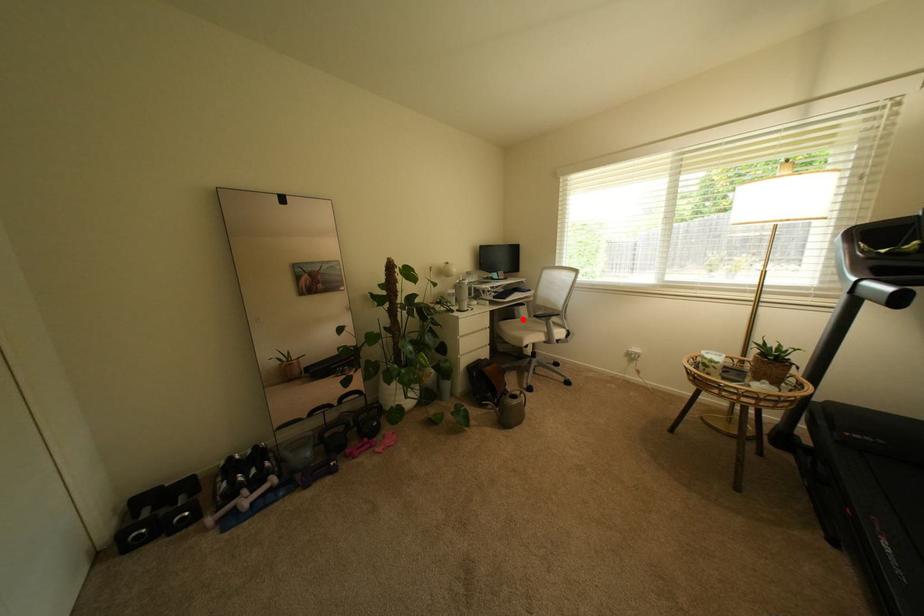
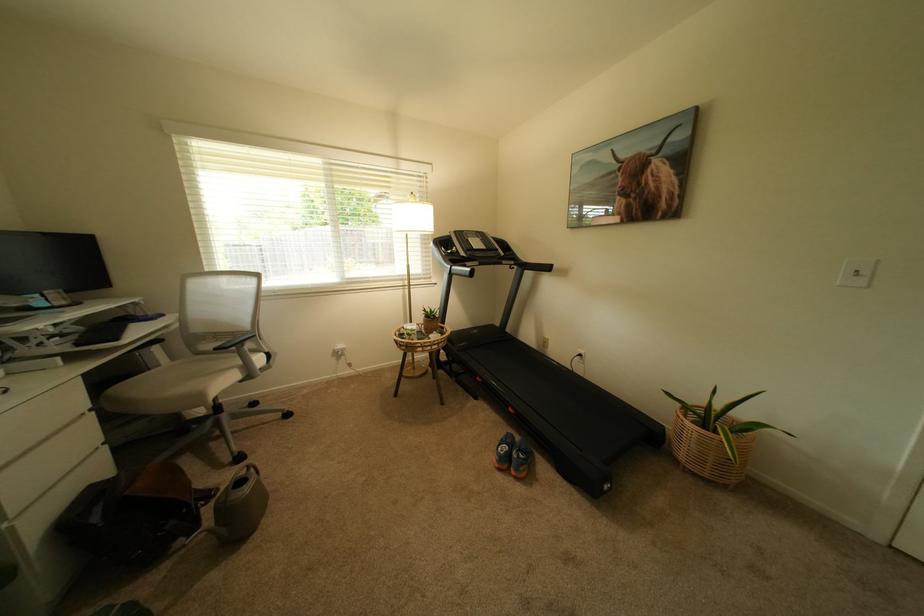
The point at the highlighted location is marked in the first image. Where is the corresponding point in the second image?

(157, 370)